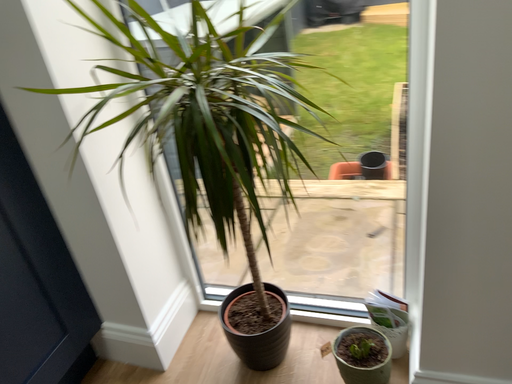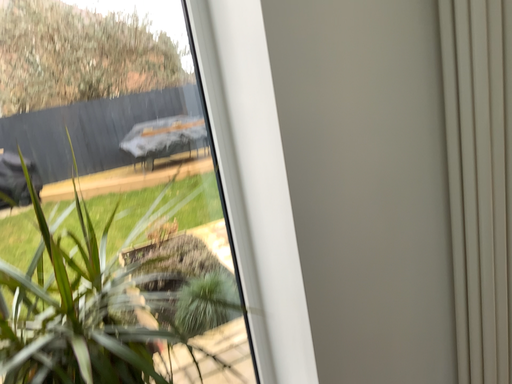
Question: How did the camera likely rotate when shooting the video?

Choices:
 (A) rotated downward
 (B) rotated upward

Answer: (B)